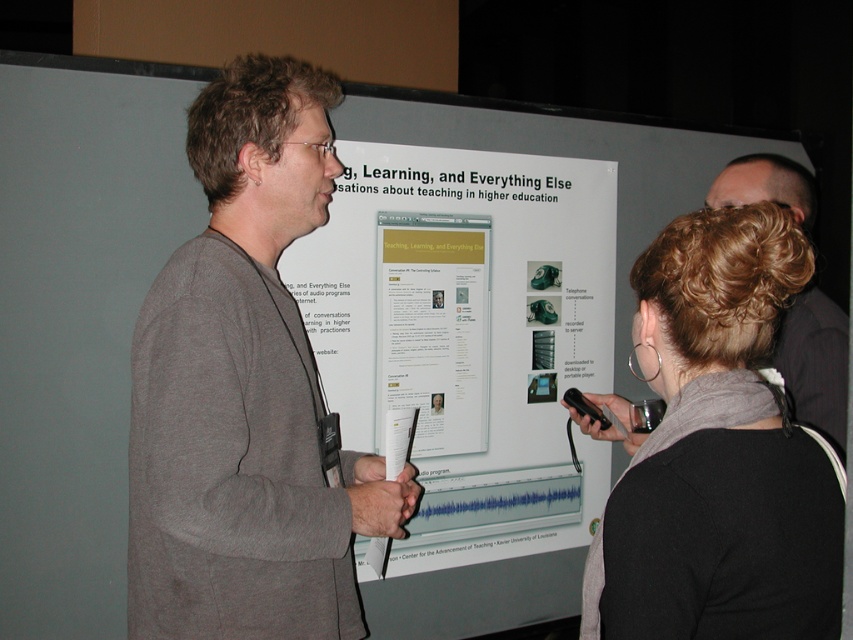
You are organizing a conference and need to ensure that all presenters have enough space to move around. The white paper poster at center and the gray cotton shirt at center are in the way. Which object should you move first to create more space for the presenter?

The gray cotton shirt at center should be moved first because the white paper poster at center is located below it, meaning the shirt is blocking the presenter more directly.